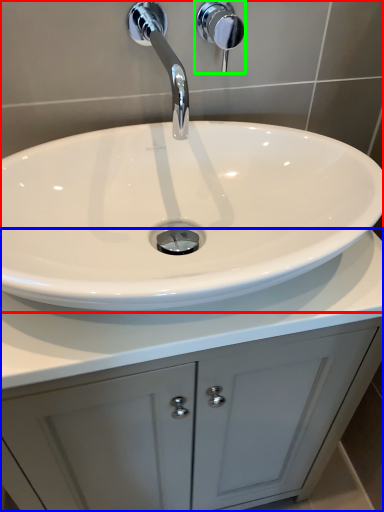
Question: Based on their relative distances, which object is nearer to sink (highlighted by a red box)? Choose from bathroom cabinet (highlighted by a blue box) and shower (highlighted by a green box).

Choices:
 (A) bathroom cabinet
 (B) shower

Answer: (B)